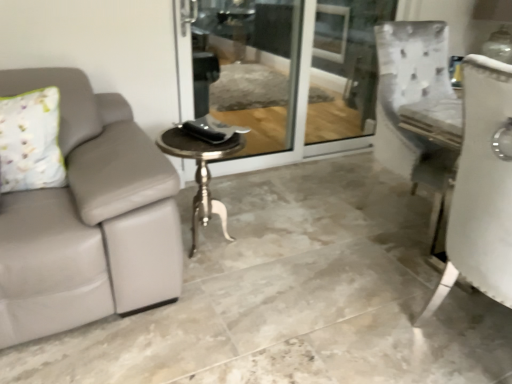
Where is `vacant space behind polished silver table at center`? Image resolution: width=512 pixels, height=384 pixels. vacant space behind polished silver table at center is located at coordinates (234, 213).